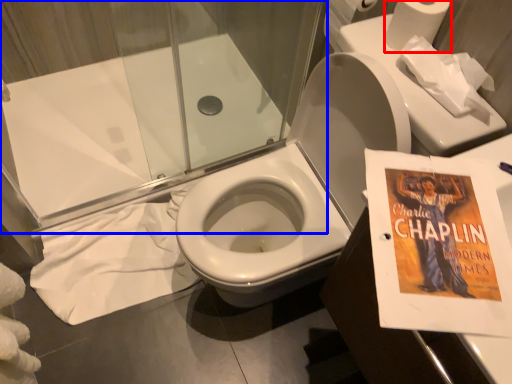
Question: Which object is further to the camera taking this photo, toilet paper (highlighted by a red box) or shower door (highlighted by a blue box)?

Choices:
 (A) toilet paper
 (B) shower door

Answer: (A)